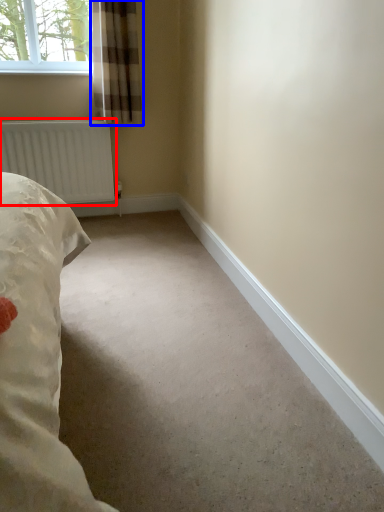
Question: Which of the following is the closest to the observer, radiator (highlighted by a red box) or curtain (highlighted by a blue box)?

Choices:
 (A) radiator
 (B) curtain

Answer: (B)